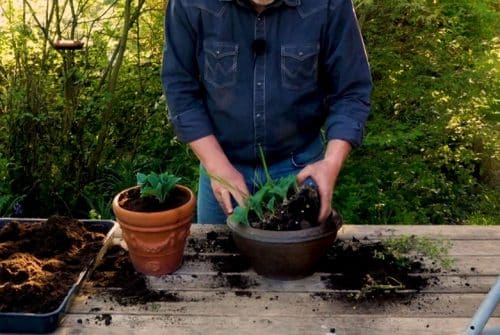
Where is `tray`? This screenshot has height=335, width=500. tray is located at coordinates (73, 294).